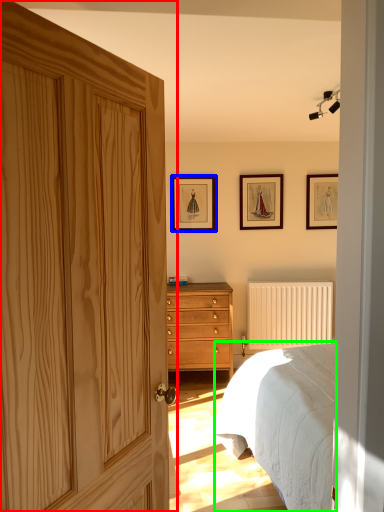
Question: Based on their relative distances, which object is farther from door (highlighted by a red box)? Choose from picture frame (highlighted by a blue box) and bed (highlighted by a green box).

Choices:
 (A) picture frame
 (B) bed

Answer: (A)